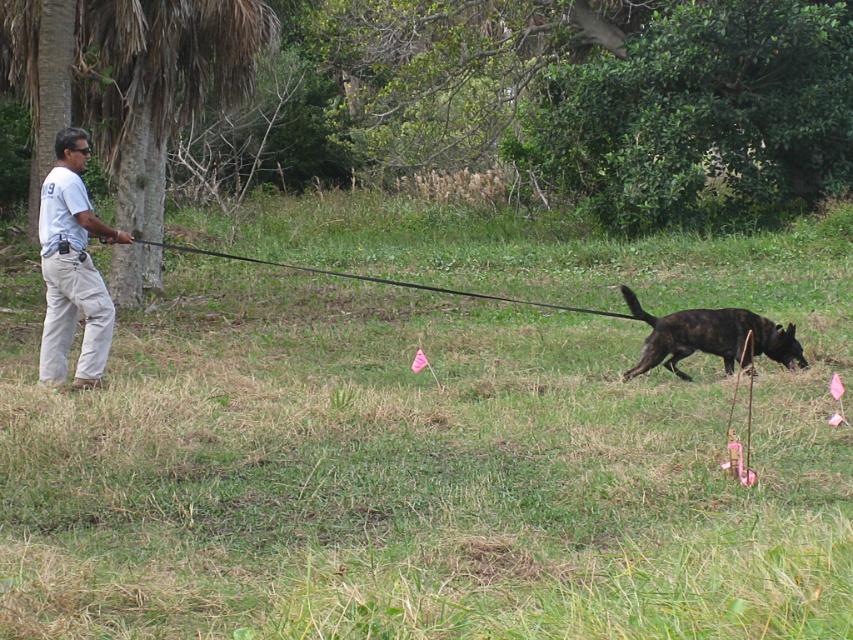
Question: Does green grassy at center appear under brindle fur dog at lower right?

Choices:
 (A) no
 (B) yes

Answer: (A)

Question: Estimate the real-world distances between objects in this image. Which object is farther from the black rubber leash at left?

Choices:
 (A) white cotton shirt at left
 (B) green grassy at center
 (C) brindle fur dog at lower right

Answer: (A)

Question: Does green grassy at center have a greater width compared to brindle fur dog at lower right?

Choices:
 (A) no
 (B) yes

Answer: (B)

Question: Can you confirm if green grassy at center is thinner than black rubber leash at left?

Choices:
 (A) no
 (B) yes

Answer: (A)

Question: Which point is closer to the camera?

Choices:
 (A) black rubber leash at left
 (B) green grassy at center
 (C) brindle fur dog at lower right
 (D) white cotton shirt at left

Answer: (B)

Question: Based on their relative distances, which object is farther from the black rubber leash at left?

Choices:
 (A) brindle fur dog at lower right
 (B) white cotton shirt at left
 (C) green grassy at center

Answer: (B)